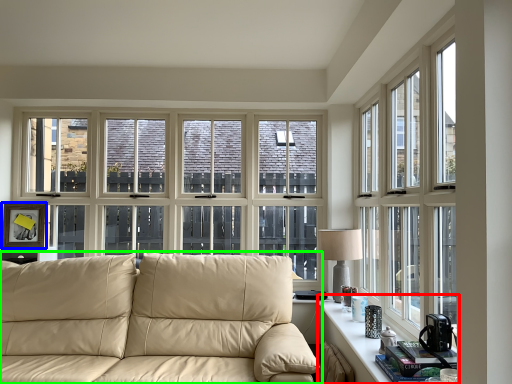
Question: Which is farther away from table (highlighted by a red box)? picture frame (highlighted by a blue box) or studio couch (highlighted by a green box)?

Choices:
 (A) picture frame
 (B) studio couch

Answer: (A)